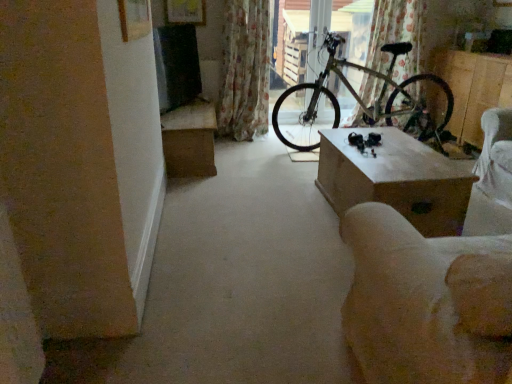
Question: From the image's perspective, relative to beige fabric armchair at lower right, is metallic bicycle at center above or below?

Choices:
 (A) below
 (B) above

Answer: (B)

Question: Considering their positions, is metallic bicycle at center located in front of or behind beige fabric armchair at lower right?

Choices:
 (A) front
 (B) behind

Answer: (B)

Question: Estimate the real-world distances between objects in this image. Which object is closer to the wooden table at center, placed as the first table when sorted from front to back?

Choices:
 (A) green metallic bicycle at center
 (B) floral fabric curtain at upper center, the first curtain positioned from the right
 (C) metallic bicycle at center
 (D) wooden box at right
 (E) brown cardboard box at left, placed as the 2th table when sorted from right to left

Answer: (A)

Question: Which object is the closest to the brown cardboard box at left, placed as the 2th table when sorted from right to left?

Choices:
 (A) metallic bicycle at center
 (B) wooden table at center, the second table in the left-to-right sequence
 (C) wooden box at right
 (D) beige fabric armchair at lower right
 (E) floral fabric curtain at upper center, the first curtain positioned from the right

Answer: (B)